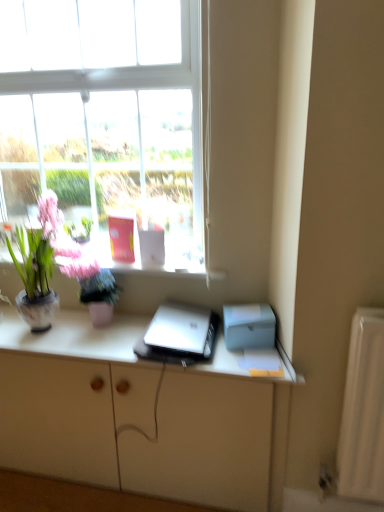
Find the location of a particular element. This screenshot has height=512, width=384. matte white cabinet at center is located at coordinates (138, 416).

Is matte white cabinet at center positioned behind transparent glass window at upper center?

Yes, it is.

From the image's perspective, between matte white cabinet at center and transparent glass window at upper center, which one is located above?

From the image's view, transparent glass window at upper center is above.

Between point (248, 473) and point (97, 33), which one is positioned in front?

The point (248, 473) is closer to the camera.

From the image's perspective, is matte ceramic vase at left positioned above or below transparent glass window at upper center?

matte ceramic vase at left is situated lower than transparent glass window at upper center in the image.

Is matte ceramic vase at left to the left or to the right of transparent glass window at upper center in the image?

From the image, it's evident that matte ceramic vase at left is to the left of transparent glass window at upper center.

Would you say matte ceramic vase at left is a long distance from transparent glass window at upper center?

Actually, matte ceramic vase at left and transparent glass window at upper center are a little close together.

Which object is closer to the camera taking this photo, matte ceramic vase at left or transparent glass window at upper center?

transparent glass window at upper center is more forward.

Is point (83, 425) positioned in front of point (46, 217)?

That is True.

From the image's perspective, which is above, matte white cabinet at center or matte ceramic vase at left?

matte ceramic vase at left.

Which object is positioned more to the right, matte white cabinet at center or matte ceramic vase at left?

matte white cabinet at center.

Measure the distance between matte white cabinet at center and matte ceramic vase at left.

14.38 inches.

Considering the sizes of objects silver metallic laptop at center and matte white cabinet at center in the image provided, who is bigger, silver metallic laptop at center or matte white cabinet at center?

matte white cabinet at center is bigger.

Between silver metallic laptop at center and matte white cabinet at center, which one has smaller width?

silver metallic laptop at center is thinner.

Is silver metallic laptop at center not close to matte white cabinet at center?

That's not correct — silver metallic laptop at center is a little close to matte white cabinet at center.

From the picture: Choose the correct answer: Is silver metallic laptop at center inside matte white cabinet at center or outside it?

silver metallic laptop at center is located beyond the bounds of matte white cabinet at center.

Is transparent glass window at upper center next to matte ceramic vase at left?

transparent glass window at upper center is not next to matte ceramic vase at left, and they're not touching.

Considering the positions of objects transparent glass window at upper center and matte ceramic vase at left in the image provided, who is more to the right, transparent glass window at upper center or matte ceramic vase at left?

From the viewer's perspective, transparent glass window at upper center appears more on the right side.

At what (x,y) coordinates should I click in order to perform the action: click on houseplant below the transparent glass window at upper center (from the image's perspective). Please return your answer as a coordinate pair (x, y). Looking at the image, I should click on (60, 270).

Is matte white cabinet at center taller or shorter than silver metallic laptop at center?

Clearly, matte white cabinet at center is taller compared to silver metallic laptop at center.

Is matte white cabinet at center thinner than silver metallic laptop at center?

In fact, matte white cabinet at center might be wider than silver metallic laptop at center.

Does matte white cabinet at center turn towards silver metallic laptop at center?

No, matte white cabinet at center does not turn towards silver metallic laptop at center.

From the image's perspective, is matte white cabinet at center under silver metallic laptop at center?

Correct, matte white cabinet at center appears lower than silver metallic laptop at center in the image.

Is silver metallic laptop at center at the back of matte ceramic vase at left?

No, silver metallic laptop at center is not at the back of matte ceramic vase at left.

Where is `laptop that appears below the matte ceramic vase at left (from the image's perspective)`? The image size is (384, 512). laptop that appears below the matte ceramic vase at left (from the image's perspective) is located at coordinates (183, 330).

Is matte ceramic vase at left positioned behind silver metallic laptop at center?

Yes, it is behind silver metallic laptop at center.

Considering the relative sizes of matte ceramic vase at left and silver metallic laptop at center in the image provided, is matte ceramic vase at left thinner than silver metallic laptop at center?

Correct, the width of matte ceramic vase at left is less than that of silver metallic laptop at center.

Where is `cabinetry lying on the right of transparent glass window at upper center`? This screenshot has width=384, height=512. cabinetry lying on the right of transparent glass window at upper center is located at coordinates (138, 416).

The image size is (384, 512). I want to click on houseplant that is on the left side of transparent glass window at upper center, so click(60, 270).

Estimate the real-world distances between objects in this image. Which object is closer to transparent glass window at upper center, matte white cabinet at center or matte ceramic vase at left?

matte ceramic vase at left is closer to transparent glass window at upper center.

Considering their positions, is silver metallic laptop at center positioned further to matte white cabinet at center than transparent glass window at upper center?

→ transparent glass window at upper center is positioned further to the anchor matte white cabinet at center.

When comparing their distances from matte white cabinet at center, does silver metallic laptop at center or matte ceramic vase at left seem closer?

Based on the image, silver metallic laptop at center appears to be nearer to matte white cabinet at center.

Based on their spatial positions, is transparent glass window at upper center or silver metallic laptop at center further from matte white cabinet at center?

transparent glass window at upper center is further to matte white cabinet at center.

From the image, which object appears to be farther from transparent glass window at upper center, matte ceramic vase at left or matte white cabinet at center?

Based on the image, matte white cabinet at center appears to be further to transparent glass window at upper center.

Estimate the real-world distances between objects in this image. Which object is further from silver metallic laptop at center, transparent glass window at upper center or matte ceramic vase at left?

The object further to silver metallic laptop at center is transparent glass window at upper center.

From the image, which object appears to be nearer to transparent glass window at upper center, matte ceramic vase at left or silver metallic laptop at center?

matte ceramic vase at left is positioned closer to the anchor transparent glass window at upper center.

From the image, which object appears to be nearer to silver metallic laptop at center, transparent glass window at upper center or matte ceramic vase at left?

matte ceramic vase at left.

You are a GUI agent. You are given a task and a screenshot of the screen. Output one action in this format:
    pyautogui.click(x=<x>, y=<y>)
    Task: Click on the desk situated between matte ceramic vase at left and silver metallic laptop at center from left to right
    This screenshot has height=512, width=384.
    Given the screenshot: What is the action you would take?
    pyautogui.click(x=74, y=336)

This screenshot has height=512, width=384. I want to click on desk between transparent glass window at upper center and matte white cabinet at center from top to bottom, so click(74, 336).

At what (x,y) coordinates should I click in order to perform the action: click on houseplant between transparent glass window at upper center and matte white cabinet at center in the up-down direction. Please return your answer as a coordinate pair (x, y). This screenshot has width=384, height=512. Looking at the image, I should click on (x=60, y=270).

Image resolution: width=384 pixels, height=512 pixels. What are the coordinates of `laptop that lies between transparent glass window at upper center and matte white cabinet at center from top to bottom` in the screenshot? It's located at (183, 330).